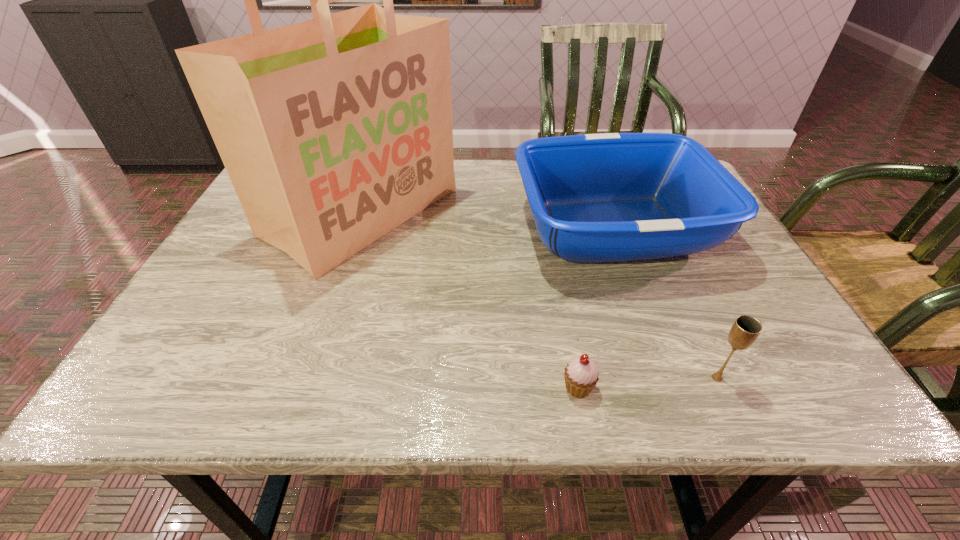
Where is `vacant position at the near left corner of the desktop`? This screenshot has height=540, width=960. vacant position at the near left corner of the desktop is located at coordinates (126, 406).

Where is `empty space between the tray and the grocery bag`? empty space between the tray and the grocery bag is located at coordinates pos(488,221).

I want to click on empty space between the chalice and the tray, so click(x=665, y=303).

The width and height of the screenshot is (960, 540). What are the coordinates of `free spot between the cupcake and the tray` in the screenshot? It's located at (595, 308).

The width and height of the screenshot is (960, 540). Find the location of `empty space that is in between the chalice and the tray`. empty space that is in between the chalice and the tray is located at coordinates (665, 303).

At what (x,y) coordinates should I click in order to perform the action: click on vacant point located between the leftmost object and the chalice. Please return your answer as a coordinate pair (x, y). The width and height of the screenshot is (960, 540). Looking at the image, I should click on (540, 295).

Identify the location of free spot between the cupcake and the chalice. (647, 383).

The width and height of the screenshot is (960, 540). I want to click on vacant area between the chalice and the tray, so pyautogui.click(x=665, y=303).

This screenshot has width=960, height=540. Identify the location of vacant area that lies between the shortest object and the chalice. (647, 383).

Locate an element on the screen. Image resolution: width=960 pixels, height=540 pixels. free point between the leftmost object and the chalice is located at coordinates (540, 295).